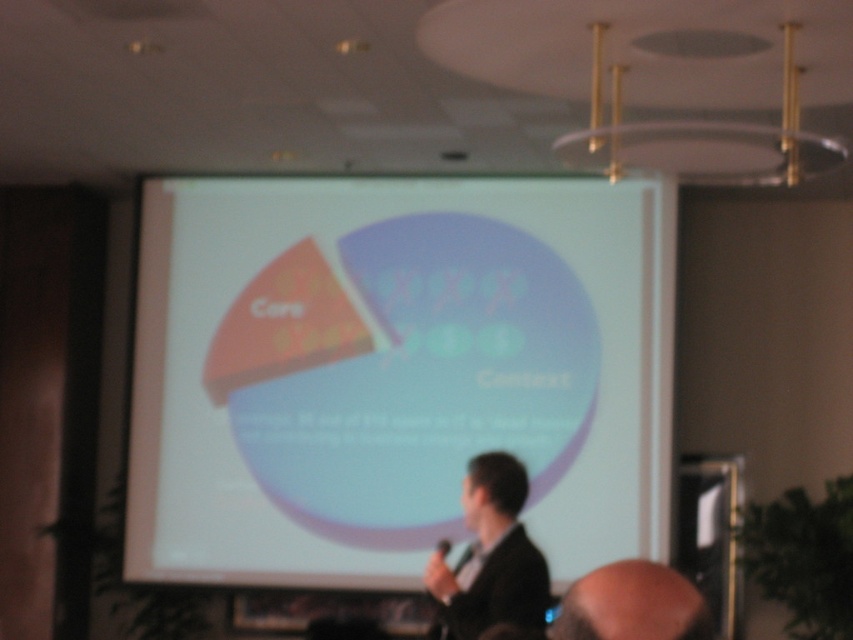
You are an attendee at the presentation and want to take a photo of the speaker and the screen. Where should you position yourself to capture both the matte white projection screen at center and the bald head at lower right in the same frame?

You should position yourself to the right of the bald head at lower right so that the matte white projection screen at center is to the left of the bald head at lower right in the frame.

You are organizing a photo shoot and need to place a large backdrop behind the dark suit at center and the bald head at lower right. Which object should you position the backdrop closer to to ensure it covers both adequately?

The backdrop should be positioned closer to the dark suit at center because it might be wider than the bald head at lower right, ensuring both are adequately covered.